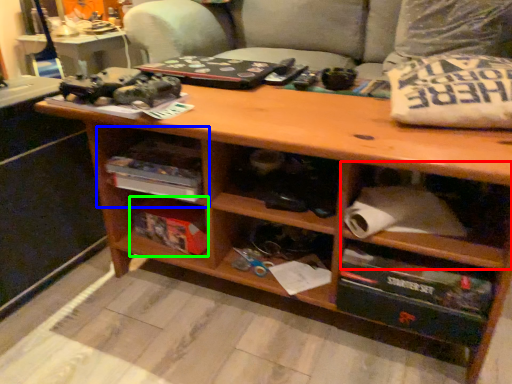
Question: Based on their relative distances, which object is nearer to cabinet (highlighted by a red box)? Choose from shelf (highlighted by a blue box) and box (highlighted by a green box).

Choices:
 (A) shelf
 (B) box

Answer: (A)